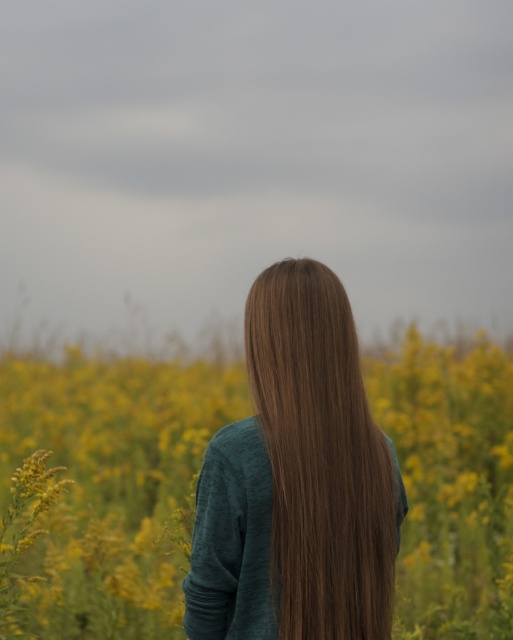
Based on the photo, you are a photographer trying to capture the brown smooth hair at center and the yellow soft textured flowers at center. Since the flowers are in the foreground, do you need to adjust your camera focus to ensure both are in focus?

The yellow soft textured flowers at center is to the left of brown smooth hair at center, so you need to adjust your camera focus to ensure both are in focus since the flowers are closer to the camera than the hair.

You are a photographer trying to capture a closeup of the yellow soft textured flowers at center and the brown smooth hair at center. Which object should you zoom in more on to ensure both are in focus?

The yellow soft textured flowers at center is smaller than the brown smooth hair at center, so you should zoom in more on the yellow soft textured flowers at center to ensure both are in focus.